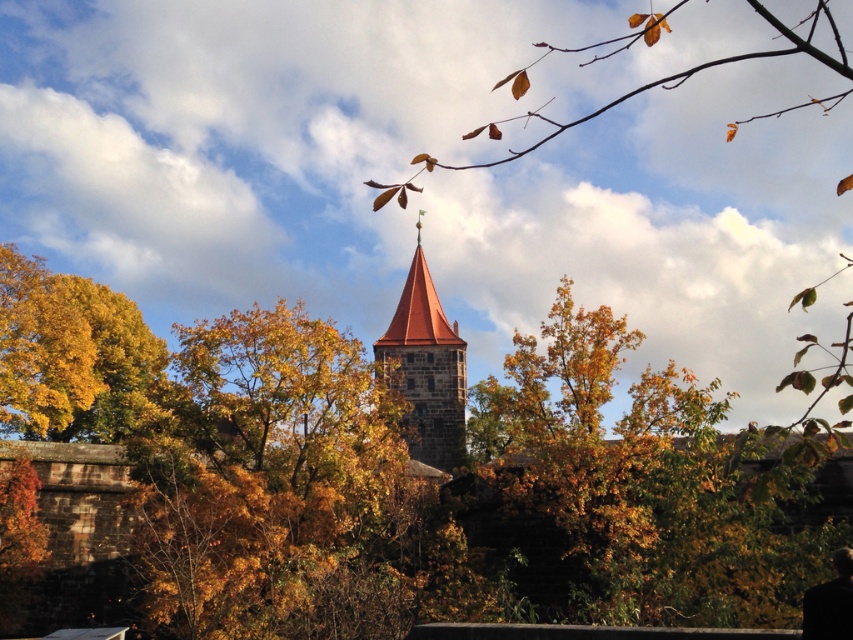
In the scene shown: Which of these two, smooth stone tower at center or black matte jacket at lower right, stands shorter?

Standing shorter between the two is black matte jacket at lower right.

Is smooth stone tower at center behind black matte jacket at lower right?

Yes, smooth stone tower at center is behind black matte jacket at lower right.

The width and height of the screenshot is (853, 640). Describe the element at coordinates (427, 369) in the screenshot. I see `smooth stone tower at center` at that location.

Image resolution: width=853 pixels, height=640 pixels. What are the coordinates of `smooth stone tower at center` in the screenshot? It's located at (427, 369).

Does golden foliage at center appear over black matte jacket at lower right?

Indeed, golden foliage at center is positioned over black matte jacket at lower right.

Based on the photo, is golden foliage at center behind black matte jacket at lower right?

No.

Is point (808, 586) farther from camera compared to point (804, 611)?

That is True.

The width and height of the screenshot is (853, 640). Identify the location of golden foliage at center. [x=640, y=486].

Is yellow-green foliage at center positioned at the back of black matte jacket at lower right?

No, it is in front of black matte jacket at lower right.

Is point (572, 193) farther from viewer compared to point (811, 625)?

That is True.

What do you see at coordinates (663, 257) in the screenshot?
I see `yellow-green foliage at center` at bounding box center [663, 257].

I want to click on yellow-green foliage at center, so click(x=663, y=257).